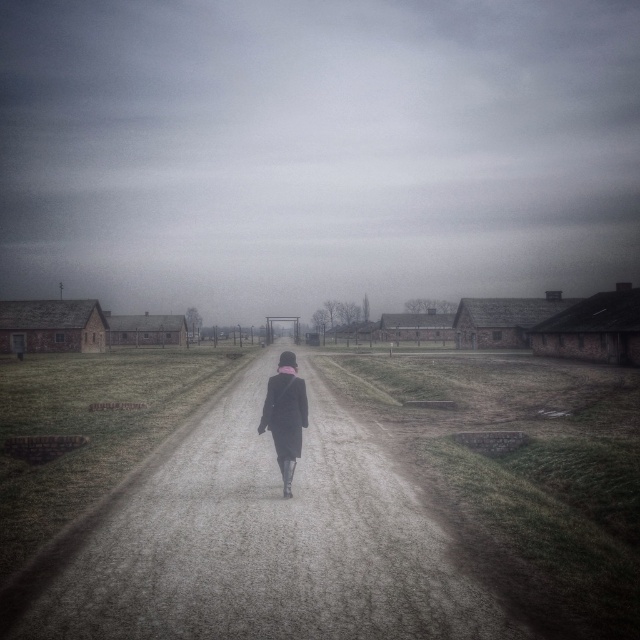
Question: Is gray fog at center wider than dirt road at center?

Choices:
 (A) yes
 (B) no

Answer: (A)

Question: Which object is farther from the camera taking this photo?

Choices:
 (A) dark gray coat at center
 (B) gray fog at center
 (C) dirt road at center

Answer: (B)

Question: Does gray fog at center appear under dirt road at center?

Choices:
 (A) no
 (B) yes

Answer: (A)

Question: Is dirt road at center closer to the viewer compared to dark gray coat at center?

Choices:
 (A) no
 (B) yes

Answer: (B)

Question: Among these points, which one is farthest from the camera?

Choices:
 (A) (285, 241)
 (B) (285, 420)
 (C) (198, 532)

Answer: (A)

Question: Which point is closer to the camera taking this photo?

Choices:
 (A) (323, 524)
 (B) (305, 394)

Answer: (A)